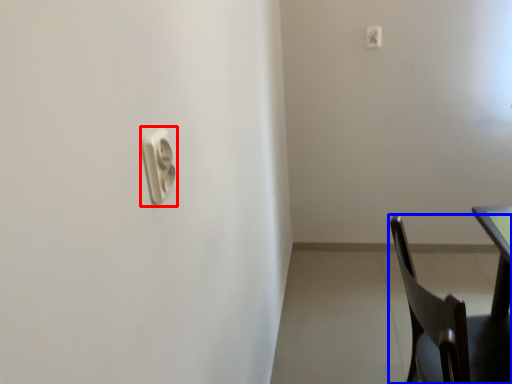
Question: Which object is further to the camera taking this photo, light switch (highlighted by a red box) or chair (highlighted by a blue box)?

Choices:
 (A) light switch
 (B) chair

Answer: (B)